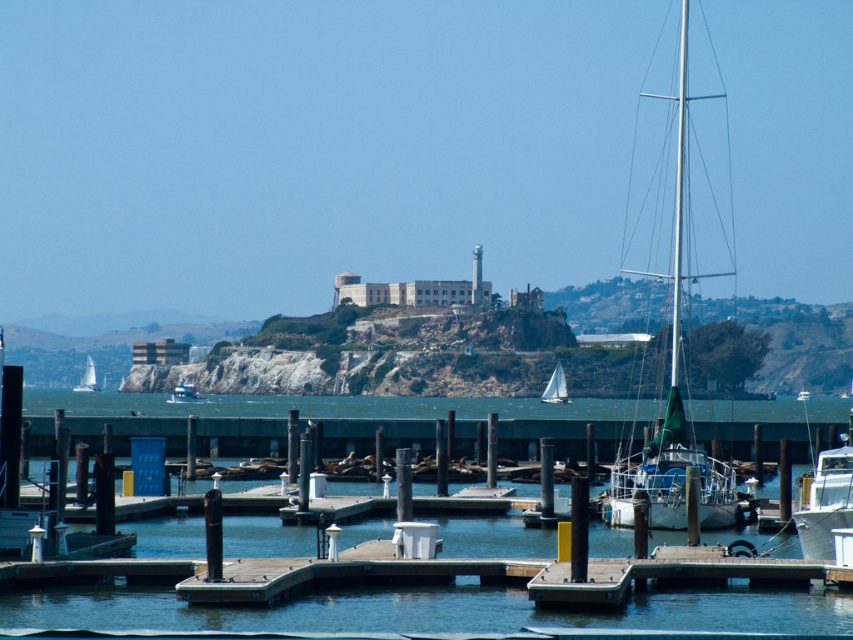
Question: Does white glossy boat at lower right appear under white sailboat at center?

Choices:
 (A) no
 (B) yes

Answer: (A)

Question: Does transparent blue water at center have a larger size compared to white glossy boat at lower right?

Choices:
 (A) no
 (B) yes

Answer: (B)

Question: Among these objects, which one is farthest from the camera?

Choices:
 (A) white sailboat at left
 (B) white glossy boat at lower right
 (C) metallic silver boat at lower center
 (D) white sailboat at center

Answer: (A)

Question: Does silver metallic mast at right have a greater width compared to metallic silver boat at lower center?

Choices:
 (A) yes
 (B) no

Answer: (A)

Question: Which object appears closest to the camera in this image?

Choices:
 (A) white sailboat at left
 (B) white sailboat at center
 (C) white glossy boat at lower right
 (D) silver metallic mast at right

Answer: (C)

Question: Among these points, which one is nearest to the camera?

Choices:
 (A) (720, 500)
 (B) (207, 401)
 (C) (90, 364)

Answer: (A)